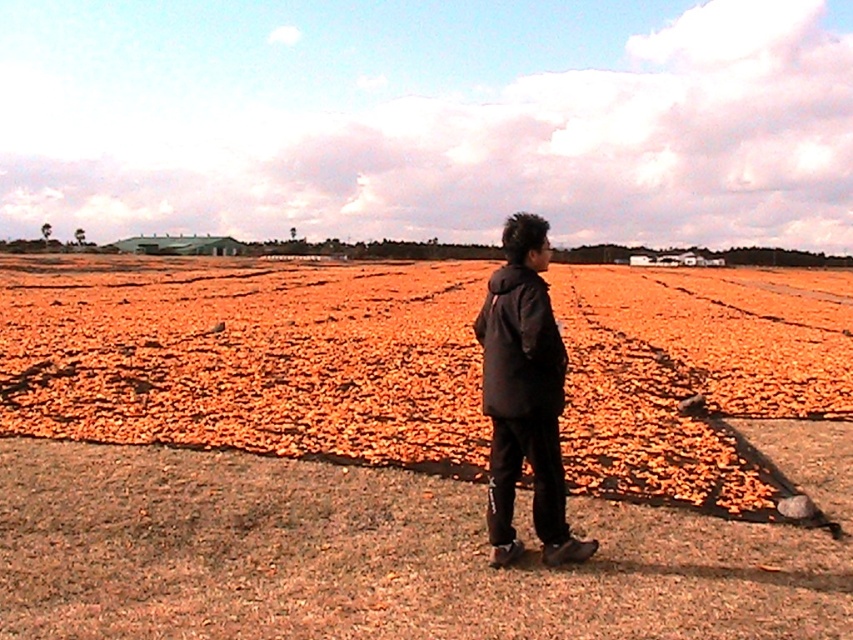
Does brown dirt field at center have a larger size compared to black matte jacket at center?

Indeed, brown dirt field at center has a larger size compared to black matte jacket at center.

Is brown dirt field at center positioned before black matte jacket at center?

Yes, brown dirt field at center is in front of black matte jacket at center.

Is point (154, 326) farther from viewer compared to point (526, 349)?

Yes.

Find the location of a particular element. This screenshot has width=853, height=640. brown dirt field at center is located at coordinates pos(395,456).